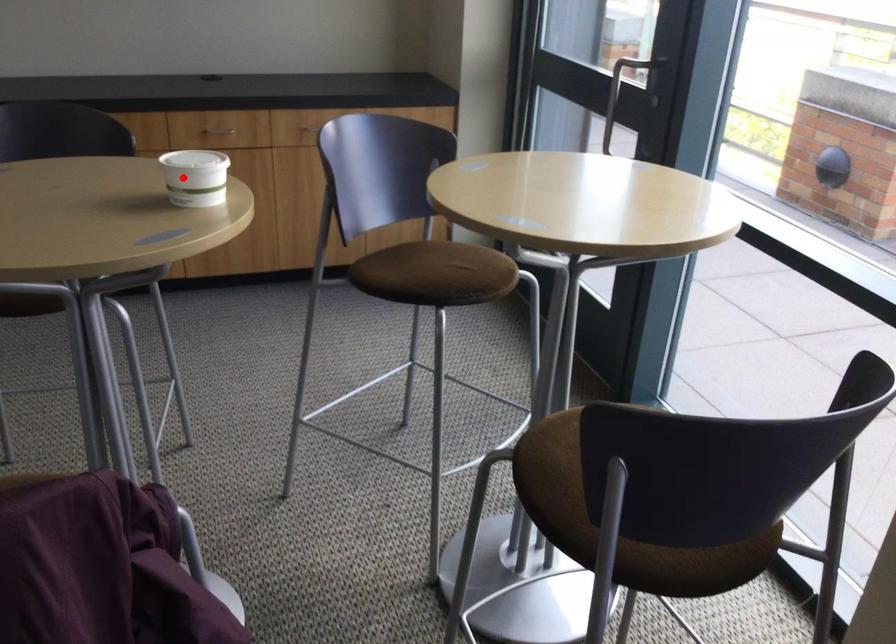
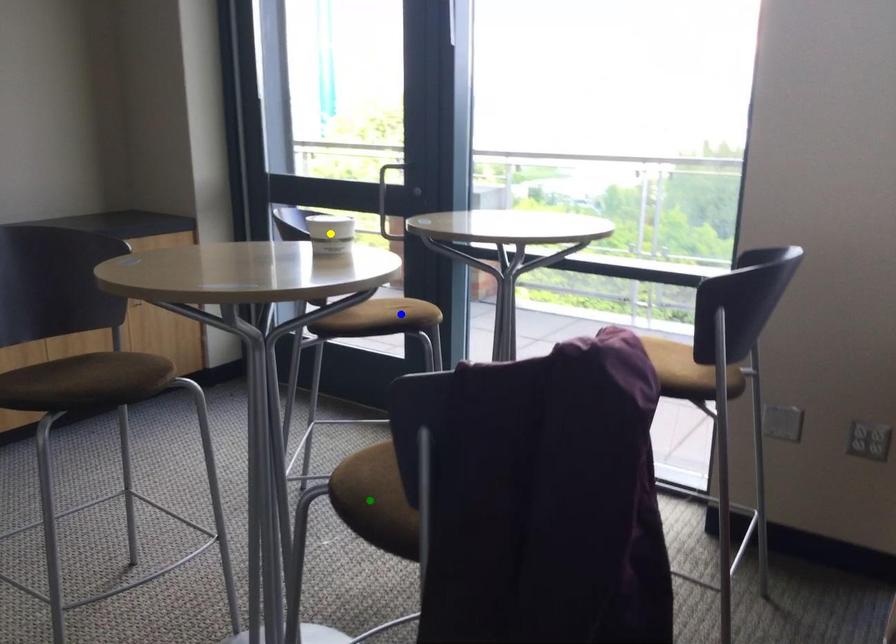
Question: I am providing you with two images of the same scene from different viewpoints. A red point is marked on the first image. You are given multiple points on the second image. Which point in image 2 represents the same 3d spot as the red point in image 1?

Choices:
 (A) blue point
 (B) green point
 (C) yellow point

Answer: (C)